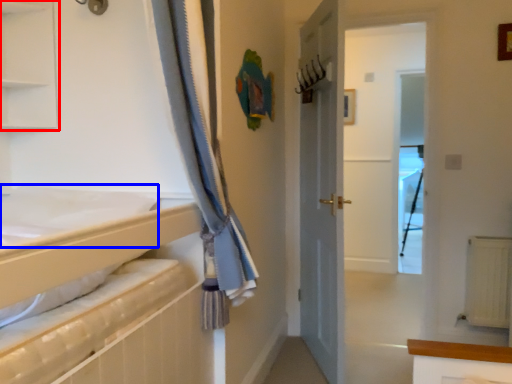
Question: Which point is closer to the camera, shelf (highlighted by a red box) or sheet (highlighted by a blue box)?

Choices:
 (A) shelf
 (B) sheet

Answer: (B)